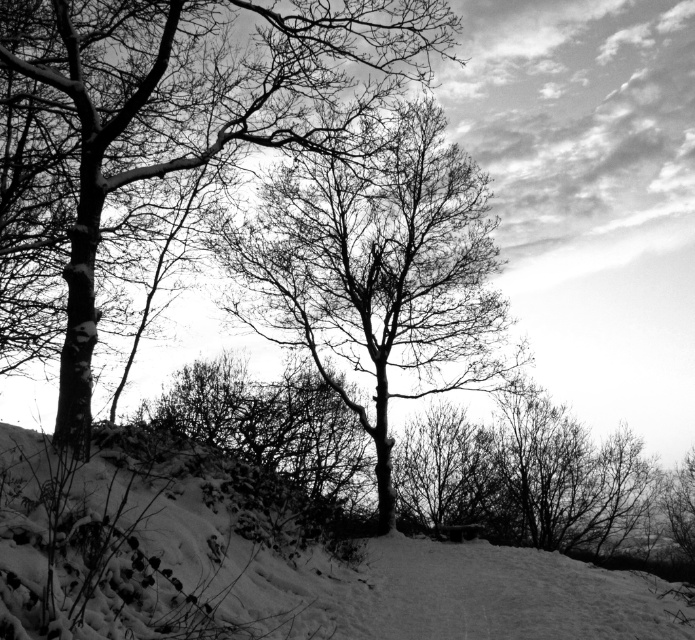
You are standing in the winter landscape scene and want to take a photo of both the point at coordinate [228,566] and the point at coordinate [172,20]. Which point will appear larger in your camera view?

Point at coordinate [228,566] will appear larger in the camera view because it is closer to the camera than point at coordinate [172,20].